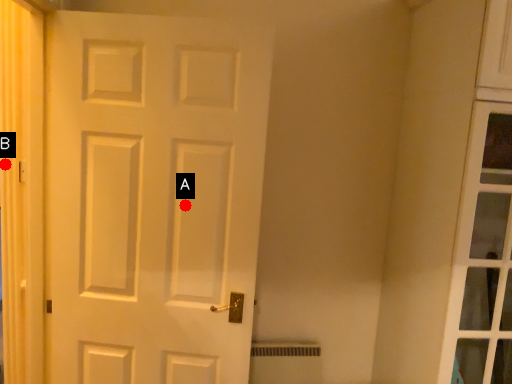
Question: Two points are circled on the image, labeled by A and B beside each circle. Among these points, which one is farthest from the camera?

Choices:
 (A) A is further
 (B) B is further

Answer: (B)